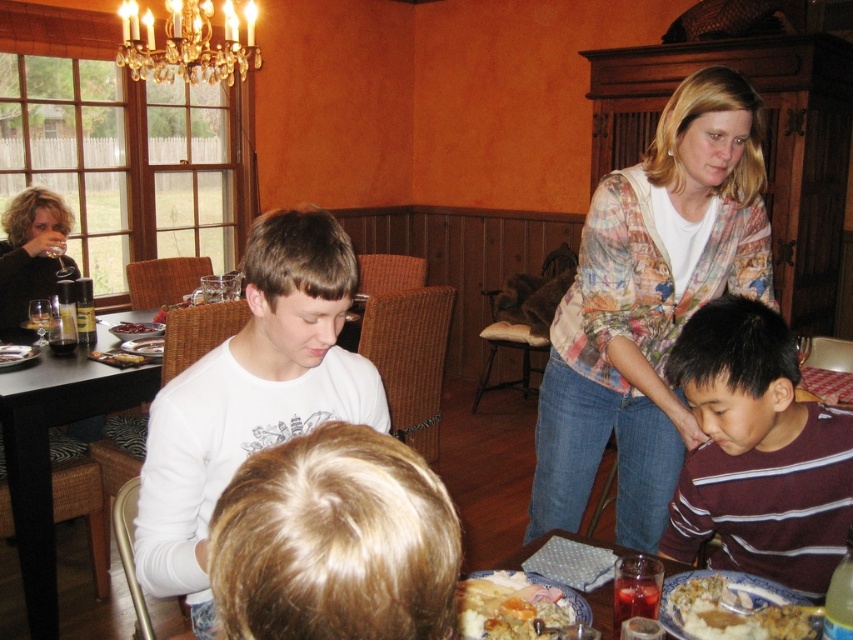
Is point (648, 540) behind point (764, 483)?

Yes, point (648, 540) is farther from viewer.

Is printed fabric shirt at upper right smaller than maroon striped shirt at lower right?

No.

Between point (589, 406) and point (813, 582), which one is positioned in front?

Point (813, 582)

This screenshot has height=640, width=853. I want to click on printed fabric shirt at upper right, so click(x=648, y=305).

Who is positioned more to the left, crystal chandelier at upper left or dark brown sweater at upper left?

Positioned to the left is dark brown sweater at upper left.

Identify the location of crystal chandelier at upper left. Image resolution: width=853 pixels, height=640 pixels. (189, 42).

Can you confirm if dark brown sweater at upper left is thinner than translucent glass cup at lower right?

Yes.

Does dark brown sweater at upper left appear over translucent glass cup at lower right?

Correct, dark brown sweater at upper left is located above translucent glass cup at lower right.

This screenshot has width=853, height=640. What do you see at coordinates (32, 253) in the screenshot?
I see `dark brown sweater at upper left` at bounding box center [32, 253].

Image resolution: width=853 pixels, height=640 pixels. Identify the location of dark brown sweater at upper left. (32, 253).